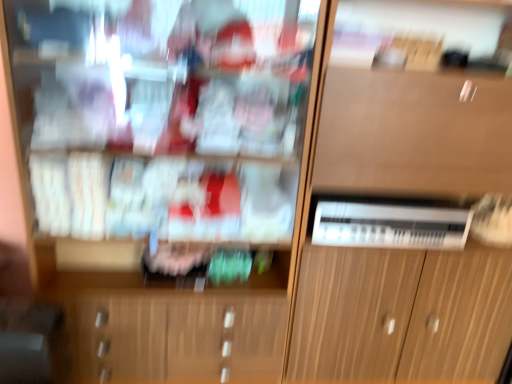
Question: Considering the relative sizes of wooden cabinet at center and wooden cabinet at center in the image provided, is wooden cabinet at center taller than wooden cabinet at center?

Choices:
 (A) no
 (B) yes

Answer: (A)

Question: Is wooden cabinet at center completely or partially outside of wooden cabinet at center?

Choices:
 (A) no
 (B) yes

Answer: (B)

Question: Could you tell me if wooden cabinet at center is facing wooden cabinet at center?

Choices:
 (A) no
 (B) yes

Answer: (A)

Question: Is wooden cabinet at center far from wooden cabinet at center?

Choices:
 (A) no
 (B) yes

Answer: (A)

Question: Does wooden cabinet at center lie in front of wooden cabinet at center?

Choices:
 (A) yes
 (B) no

Answer: (A)

Question: Relative to wooden cabinet at center, is wooden cabinet at center in front or behind?

Choices:
 (A) behind
 (B) front

Answer: (B)

Question: Is point (143, 48) positioned closer to the camera than point (346, 203)?

Choices:
 (A) closer
 (B) farther

Answer: (A)

Question: In terms of height, does wooden cabinet at center look taller or shorter compared to wooden cabinet at center?

Choices:
 (A) short
 (B) tall

Answer: (A)

Question: Is wooden cabinet at center bigger or smaller than wooden cabinet at center?

Choices:
 (A) small
 (B) big

Answer: (A)

Question: Considering the positions of wooden cabinet at center and wooden cabinet at center in the image, is wooden cabinet at center bigger or smaller than wooden cabinet at center?

Choices:
 (A) big
 (B) small

Answer: (A)

Question: Is wooden cabinet at center wider or thinner than wooden cabinet at center?

Choices:
 (A) thin
 (B) wide

Answer: (B)

Question: Is wooden cabinet at center to the left or to the right of wooden cabinet at center in the image?

Choices:
 (A) right
 (B) left

Answer: (A)

Question: In the image, is wooden cabinet at center positioned in front of or behind wooden cabinet at center?

Choices:
 (A) behind
 (B) front

Answer: (A)

Question: Is point (32, 190) closer or farther from the camera than point (325, 228)?

Choices:
 (A) closer
 (B) farther

Answer: (A)

Question: From the image's perspective, is wooden cabinet at center above or below white plastic appliance at center?

Choices:
 (A) below
 (B) above

Answer: (B)